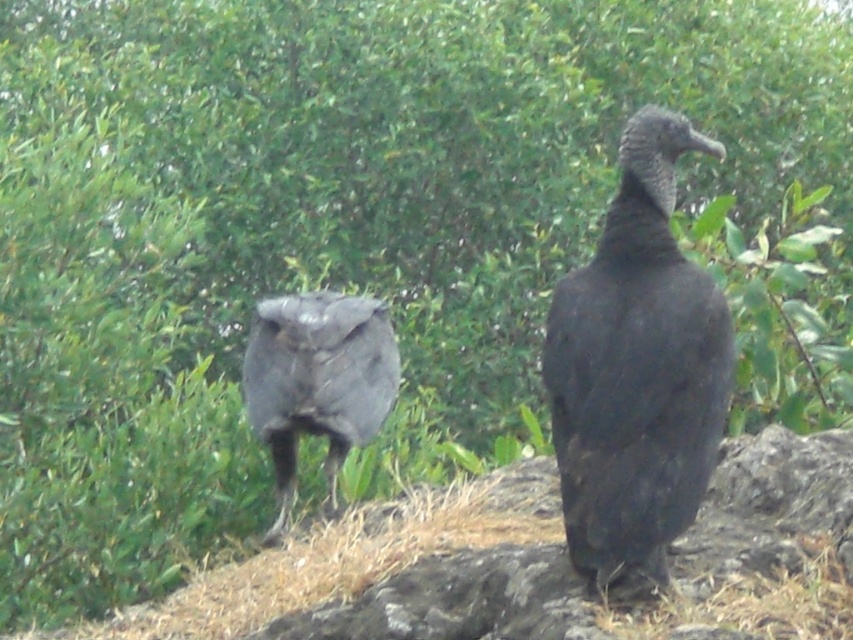
You are a birdwatcher trying to identify two birds in the image. You notice both the matte black vulture at center and the shiny black bird at center. Which one is positioned closer to you?

The matte black vulture at center is closer to the viewer than the shiny black bird at center.

You are a wildlife photographer aiming to capture a closeup shot of the matte black vulture at center. Your camera requires a minimum distance of 10 feet to focus properly. Based on the scene, can you determine if you can take the photo from your current position?

The matte black vulture at center and camera are 9.13 feet apart, which is less than the required 10 feet. Therefore, you cannot take the photo from your current position as the camera cannot focus properly at this distance.